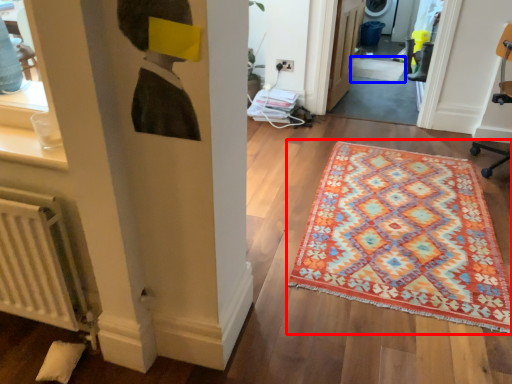
Question: Among these objects, which one is nearest to the camera, mat (highlighted by a red box) or doormat (highlighted by a blue box)?

Choices:
 (A) mat
 (B) doormat

Answer: (A)